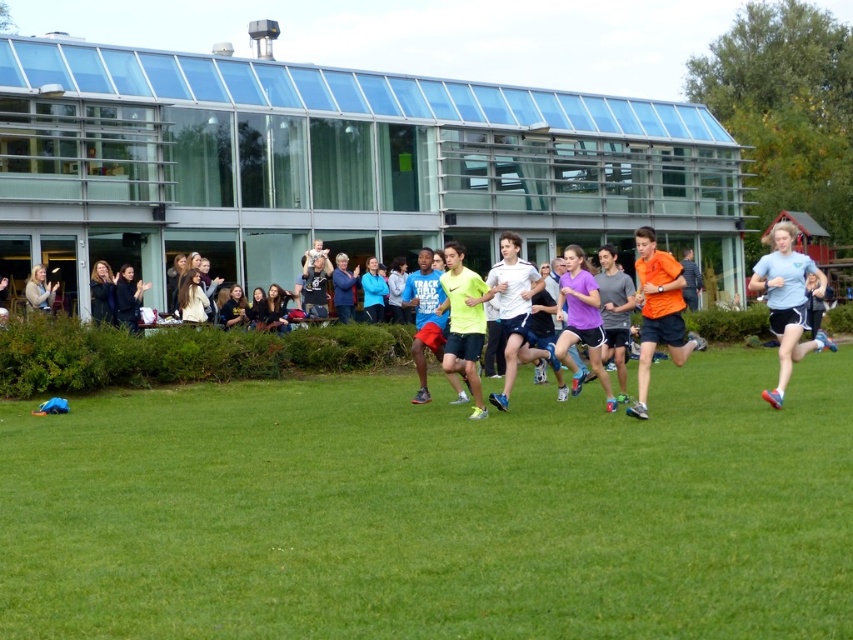
You are standing at the starting line of the race and want to reach both the point at coordinates (425, 284) and the point at (50, 285). Which point should you head towards first if you want to reach the one closer to you first?

You should head towards point (425, 284) first because it is closer to you than point (50, 285).